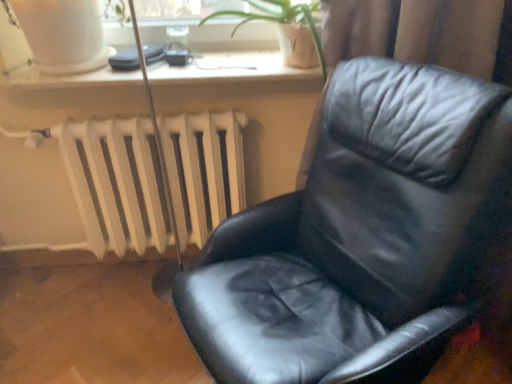
Question: Is black leather chair at center at the left side of green leafy plant at upper center?

Choices:
 (A) no
 (B) yes

Answer: (A)

Question: Does black leather chair at center have a greater height compared to green leafy plant at upper center?

Choices:
 (A) no
 (B) yes

Answer: (B)

Question: Is black leather chair at center touching green leafy plant at upper center?

Choices:
 (A) yes
 (B) no

Answer: (B)

Question: From a real-world perspective, is black leather chair at center physically above green leafy plant at upper center?

Choices:
 (A) no
 (B) yes

Answer: (A)

Question: Is the position of black leather chair at center more distant than that of green leafy plant at upper center?

Choices:
 (A) yes
 (B) no

Answer: (B)

Question: From the image's perspective, is white plastic window sill at upper center positioned above or below green leafy plant at upper center?

Choices:
 (A) above
 (B) below

Answer: (B)

Question: Considering the relative positions of white plastic window sill at upper center and green leafy plant at upper center in the image provided, is white plastic window sill at upper center to the left or to the right of green leafy plant at upper center?

Choices:
 (A) left
 (B) right

Answer: (A)

Question: Is point (18, 89) closer or farther from the camera than point (238, 26)?

Choices:
 (A) closer
 (B) farther

Answer: (A)

Question: Is white plastic window sill at upper center situated inside green leafy plant at upper center or outside?

Choices:
 (A) outside
 (B) inside

Answer: (A)

Question: Do you think green leafy plant at upper center is within white matte radiator at lower left, or outside of it?

Choices:
 (A) inside
 (B) outside

Answer: (B)

Question: Visually, is green leafy plant at upper center positioned to the left or to the right of white matte radiator at lower left?

Choices:
 (A) left
 (B) right

Answer: (B)

Question: Is green leafy plant at upper center bigger or smaller than white matte radiator at lower left?

Choices:
 (A) big
 (B) small

Answer: (B)

Question: From the image's perspective, relative to white matte radiator at lower left, is green leafy plant at upper center above or below?

Choices:
 (A) above
 (B) below

Answer: (A)

Question: From the image's perspective, is white matte radiator at lower left positioned above or below black leather chair at center?

Choices:
 (A) below
 (B) above

Answer: (B)

Question: Looking at their shapes, would you say white matte radiator at lower left is wider or thinner than black leather chair at center?

Choices:
 (A) wide
 (B) thin

Answer: (B)